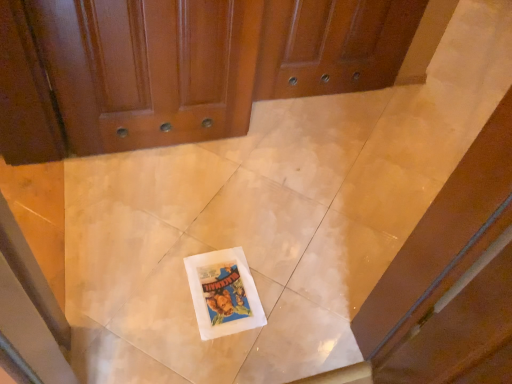
You are a GUI agent. You are given a task and a screenshot of the screen. Output one action in this format:
    pyautogui.click(x=<x>, y=<y>)
    Task: Click on the free spot below glossy wood door at upper center (from a real-world perspective)
    The image size is (512, 384).
    Given the screenshot: What is the action you would take?
    pos(167,150)